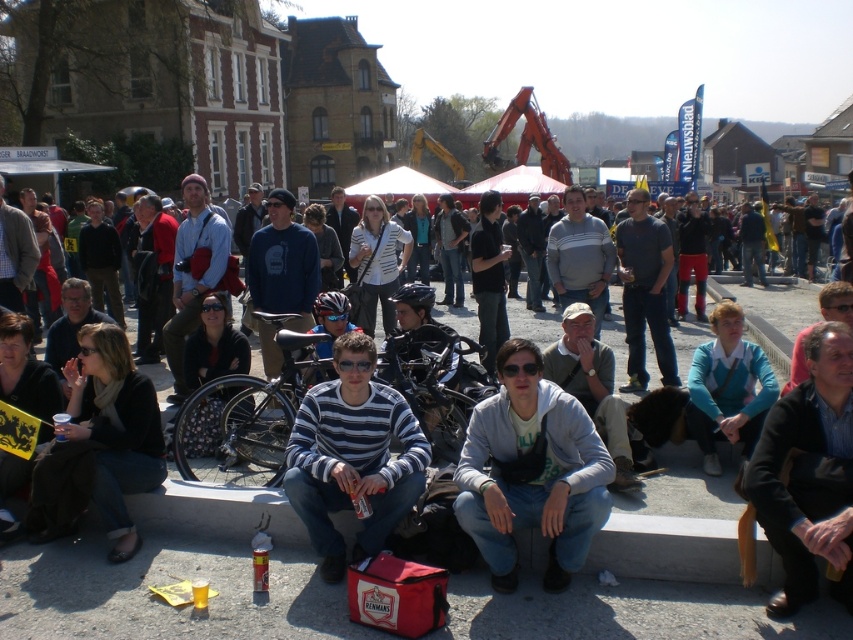
Question: Which object is positioned closest to the black leather jacket at lower right?

Choices:
 (A) silver metallic bicycle at center
 (B) teal sweater at center
 (C) gray cotton hoodie at center
 (D) striped cotton shirt at center

Answer: (C)

Question: Does silver metallic bicycle at center have a greater width compared to teal sweater at center?

Choices:
 (A) yes
 (B) no

Answer: (A)

Question: Is gray cotton hoodie at center positioned before teal sweater at center?

Choices:
 (A) no
 (B) yes

Answer: (B)

Question: Estimate the real-world distances between objects in this image. Which object is farther from the gray cotton hoodie at center?

Choices:
 (A) dark gray scarf at lower left
 (B) black leather jacket at lower right
 (C) silver metallic bicycle at center
 (D) teal sweater at center

Answer: (A)

Question: Can you confirm if striped cotton shirt at center is thinner than dark gray scarf at lower left?

Choices:
 (A) yes
 (B) no

Answer: (B)

Question: Which object appears farthest from the camera in this image?

Choices:
 (A) teal sweater at center
 (B) dark gray scarf at lower left
 (C) black leather jacket at lower right

Answer: (A)